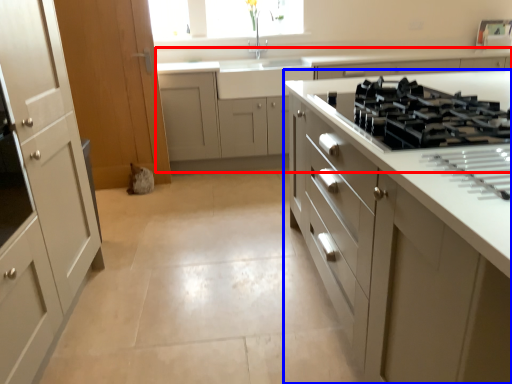
Question: Which object appears closest to the camera in this image, cabinetry (highlighted by a red box) or cabinetry (highlighted by a blue box)?

Choices:
 (A) cabinetry
 (B) cabinetry

Answer: (B)